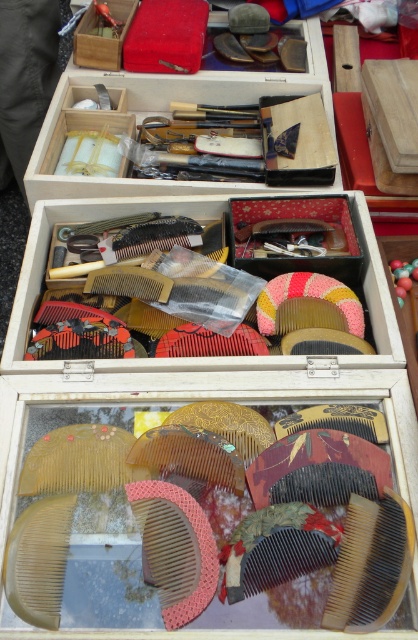
Question: Which point is closer to the camera taking this photo?

Choices:
 (A) (18, 516)
 (B) (372, 508)
 (C) (214, 205)

Answer: (B)

Question: Which point is closer to the camera?

Choices:
 (A) (395, 593)
 (B) (13, 545)

Answer: (A)

Question: Which object appears farthest from the camera in this image?

Choices:
 (A) brown wooden comb at center
 (B) translucent plastic combs at center

Answer: (A)

Question: From the image, what is the correct spatial relationship of brown wooden comb at center in relation to translucent amber comb at lower left?

Choices:
 (A) below
 (B) above

Answer: (B)

Question: Is translucent plastic combs at center to the right of brown wooden comb at center from the viewer's perspective?

Choices:
 (A) yes
 (B) no

Answer: (B)

Question: Does brown wooden comb at center appear under translucent amber comb at lower left?

Choices:
 (A) yes
 (B) no

Answer: (B)